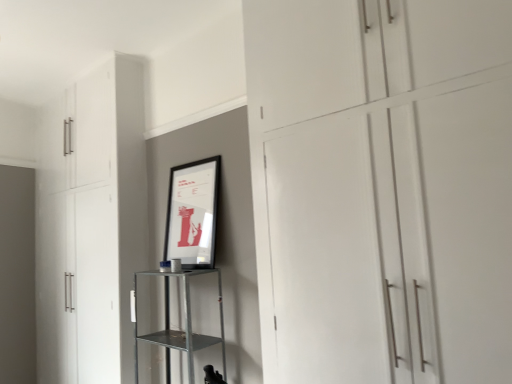
Image resolution: width=512 pixels, height=384 pixels. I want to click on metallic silver shelf at center, so click(x=185, y=323).

The height and width of the screenshot is (384, 512). Find the location of `matte black picture frame at center`. matte black picture frame at center is located at coordinates (193, 213).

Image resolution: width=512 pixels, height=384 pixels. What do you see at coordinates (382, 189) in the screenshot?
I see `white matte cupboard at center, which is the 2th cupboard from left to right` at bounding box center [382, 189].

What are the coordinates of `white matte cabinet at left, marked as the second cupboard in a front-to-back arrangement` in the screenshot? It's located at point(91,225).

This screenshot has width=512, height=384. In order to click on metallic silver shelf at center in this screenshot , I will do `click(185, 323)`.

In the scene shown: How many degrees apart are the facing directions of white matte cupboard at center, the first cupboard when ordered from front to back, and matte black picture frame at center?

They differ by 0.00065 degrees in their facing directions.

Considering their positions, is white matte cupboard at center, which ranks as the 1th cupboard in right-to-left order, located in front of or behind matte black picture frame at center?

In the image, white matte cupboard at center, which ranks as the 1th cupboard in right-to-left order, appears in front of matte black picture frame at center.

Between white matte cupboard at center, which ranks as the 1th cupboard in right-to-left order, and matte black picture frame at center, which one has more height?

white matte cupboard at center, which ranks as the 1th cupboard in right-to-left order.

From the image's perspective, relative to matte black picture frame at center, is metallic silver shelf at center above or below?

metallic silver shelf at center is below matte black picture frame at center.

Is metallic silver shelf at center placed right next to matte black picture frame at center?

They are not placed beside each other.

Would you say white matte cabinet at left, marked as the second cupboard in a front-to-back arrangement, is a long distance from white matte cupboard at center, which ranks as the 1th cupboard in right-to-left order?

white matte cabinet at left, marked as the second cupboard in a front-to-back arrangement, is positioned a significant distance from white matte cupboard at center, which ranks as the 1th cupboard in right-to-left order.

Between white matte cabinet at left, marked as the second cupboard in a front-to-back arrangement, and white matte cupboard at center, which appears as the 2th cupboard when viewed from the back, which one appears on the right side from the viewer's perspective?

Positioned to the right is white matte cupboard at center, which appears as the 2th cupboard when viewed from the back.

Looking at their sizes, would you say white matte cabinet at left, marked as the second cupboard in a front-to-back arrangement, is wider or thinner than white matte cupboard at center, the first cupboard when ordered from front to back?

In the image, white matte cabinet at left, marked as the second cupboard in a front-to-back arrangement, appears to be wider than white matte cupboard at center, the first cupboard when ordered from front to back.

How far apart are white matte cabinet at left, marked as the second cupboard in a front-to-back arrangement, and metallic silver shelf at center?

They are 33.73 inches apart.

The height and width of the screenshot is (384, 512). Identify the location of shelf lying below the white matte cabinet at left, placed as the first cupboard when sorted from left to right (from the image's perspective). (185, 323).

Which is behind, point (98, 258) or point (184, 290)?

The point (98, 258) is behind.

Considering the sizes of white matte cabinet at left, marked as the second cupboard in a front-to-back arrangement, and metallic silver shelf at center in the image, is white matte cabinet at left, marked as the second cupboard in a front-to-back arrangement, taller or shorter than metallic silver shelf at center?

Considering their sizes, white matte cabinet at left, marked as the second cupboard in a front-to-back arrangement, has more height than metallic silver shelf at center.

This screenshot has width=512, height=384. Find the location of `cupboard above the white matte cabinet at left, placed as the first cupboard when sorted from left to right (from the image's perspective)`. cupboard above the white matte cabinet at left, placed as the first cupboard when sorted from left to right (from the image's perspective) is located at coordinates (382, 189).

From a real-world perspective, between white matte cupboard at center, the first cupboard when ordered from front to back, and white matte cabinet at left, placed as the first cupboard when sorted from left to right, who is vertically higher?

white matte cupboard at center, the first cupboard when ordered from front to back.

Is white matte cupboard at center, the first cupboard when ordered from front to back, completely or partially outside of white matte cabinet at left, marked as the second cupboard in a front-to-back arrangement?

Absolutely, white matte cupboard at center, the first cupboard when ordered from front to back, is external to white matte cabinet at left, marked as the second cupboard in a front-to-back arrangement.

Between matte black picture frame at center and metallic silver shelf at center, which one has larger width?

metallic silver shelf at center.

Is matte black picture frame at center positioned in front of metallic silver shelf at center?

That is False.

Which point is more forward, (196, 230) or (188, 281)?

Point (196, 230)

Based on their sizes in the image, would you say white matte cupboard at center, the first cupboard when ordered from front to back, is bigger or smaller than metallic silver shelf at center?

Considering their sizes, white matte cupboard at center, the first cupboard when ordered from front to back, takes up more space than metallic silver shelf at center.

How different are the orientations of white matte cupboard at center, which is the 2th cupboard from left to right, and metallic silver shelf at center in degrees?

There is a 0.000441-degree angle between the facing directions of white matte cupboard at center, which is the 2th cupboard from left to right, and metallic silver shelf at center.

Is point (455, 250) closer or farther from the camera than point (165, 312)?

Point (455, 250) is positioned closer to the camera compared to point (165, 312).

From a real-world perspective, count 2nd cupboards upward from the metallic silver shelf at center and point to it. Please provide its 2D coordinates.

[(382, 189)]

This screenshot has width=512, height=384. I want to click on cupboard in front of the matte black picture frame at center, so click(382, 189).

Locate an element on the screen. shelf below the matte black picture frame at center (from the image's perspective) is located at coordinates (185, 323).

From the picture: When comparing their distances from matte black picture frame at center, does white matte cabinet at left, marked as the second cupboard in a front-to-back arrangement, or metallic silver shelf at center seem further?

white matte cabinet at left, marked as the second cupboard in a front-to-back arrangement, is positioned further to the anchor matte black picture frame at center.

From the image, which object appears to be nearer to matte black picture frame at center, white matte cupboard at center, which is the 2th cupboard from left to right, or white matte cabinet at left, placed as the first cupboard when sorted from left to right?

white matte cabinet at left, placed as the first cupboard when sorted from left to right, lies closer to matte black picture frame at center than the other object.

Estimate the real-world distances between objects in this image. Which object is closer to white matte cabinet at left, marked as the second cupboard in a front-to-back arrangement, matte black picture frame at center or metallic silver shelf at center?

metallic silver shelf at center is positioned closer to the anchor white matte cabinet at left, marked as the second cupboard in a front-to-back arrangement.

From the image, which object appears to be nearer to white matte cupboard at center, which is the 2th cupboard from left to right, metallic silver shelf at center or matte black picture frame at center?

matte black picture frame at center lies closer to white matte cupboard at center, which is the 2th cupboard from left to right, than the other object.

Looking at the image, which one is located closer to white matte cabinet at left, marked as the second cupboard in a front-to-back arrangement, white matte cupboard at center, which appears as the 2th cupboard when viewed from the back, or matte black picture frame at center?

matte black picture frame at center is closer to white matte cabinet at left, marked as the second cupboard in a front-to-back arrangement.

Considering their positions, is white matte cupboard at center, which is the 2th cupboard from left to right, positioned closer to matte black picture frame at center than metallic silver shelf at center?

Among the two, metallic silver shelf at center is located nearer to matte black picture frame at center.

From the image, which object appears to be farther from matte black picture frame at center, metallic silver shelf at center or white matte cabinet at left, the first cupboard when ordered from back to front?

Among the two, white matte cabinet at left, the first cupboard when ordered from back to front, is located further to matte black picture frame at center.

From the image, which object appears to be nearer to white matte cupboard at center, the first cupboard when ordered from front to back, matte black picture frame at center or metallic silver shelf at center?

matte black picture frame at center lies closer to white matte cupboard at center, the first cupboard when ordered from front to back, than the other object.

Image resolution: width=512 pixels, height=384 pixels. I want to click on shelf between white matte cupboard at center, which is the 2th cupboard from left to right, and matte black picture frame at center in the front-back direction, so click(185, 323).

Identify the location of picture frame situated between white matte cabinet at left, the first cupboard when ordered from back to front, and white matte cupboard at center, which appears as the 2th cupboard when viewed from the back, from left to right. Image resolution: width=512 pixels, height=384 pixels. (193, 213).

Where is `shelf located between white matte cabinet at left, the 2th cupboard viewed from the right, and matte black picture frame at center in the left-right direction`? This screenshot has width=512, height=384. shelf located between white matte cabinet at left, the 2th cupboard viewed from the right, and matte black picture frame at center in the left-right direction is located at coordinates (185, 323).

The image size is (512, 384). In order to click on shelf between white matte cabinet at left, the first cupboard when ordered from back to front, and white matte cupboard at center, which appears as the 2th cupboard when viewed from the back, in the horizontal direction in this screenshot , I will do `click(185, 323)`.